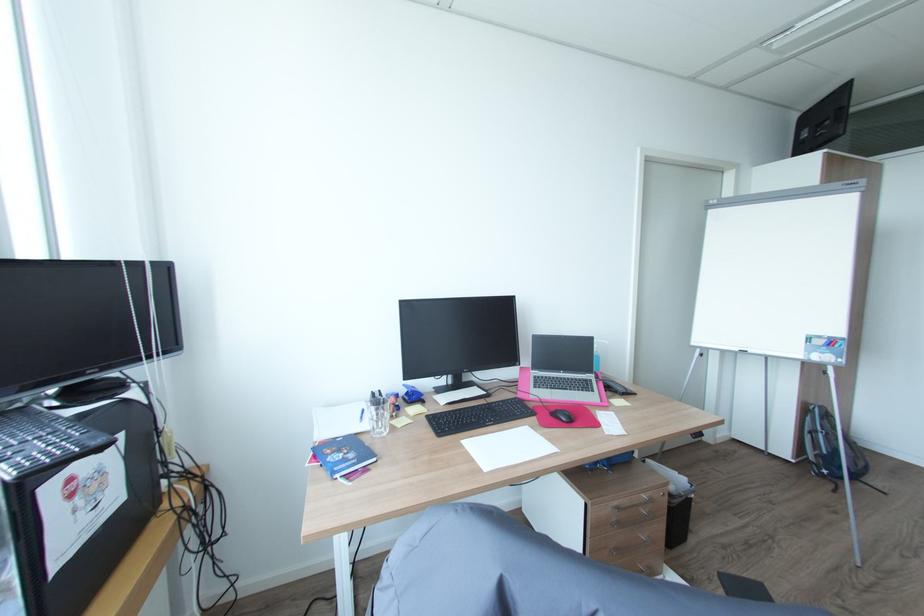
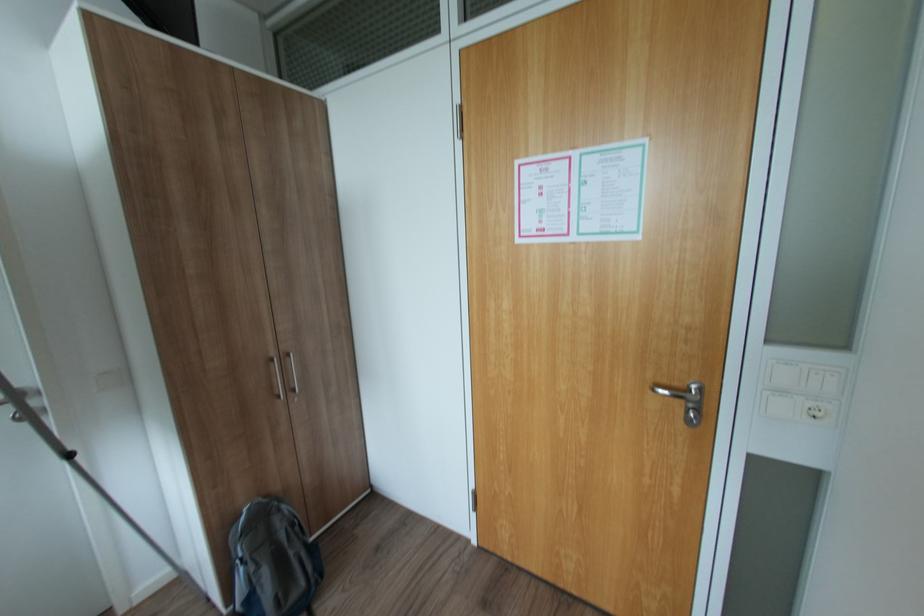
Where in the second image is the point corresponding to [817,459] from the first image?

(244, 608)